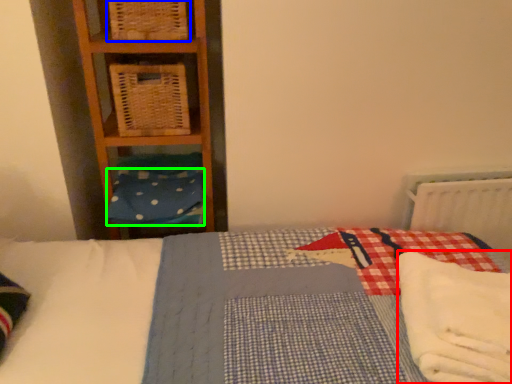
Question: Estimate the real-world distances between objects in this image. Which object is closer to material (highlighted by a red box), crate (highlighted by a blue box) or pillow (highlighted by a green box)?

Choices:
 (A) crate
 (B) pillow

Answer: (B)